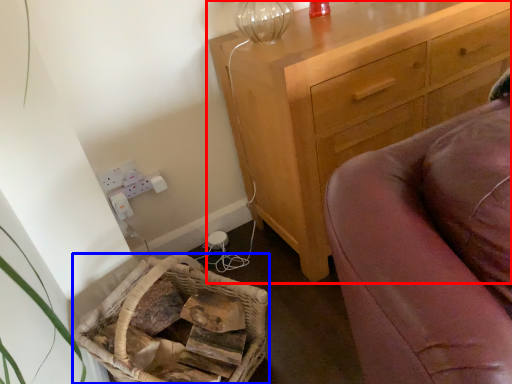
Question: Among these objects, which one is nearest to the camera, chest of drawers (highlighted by a red box) or basket (highlighted by a blue box)?

Choices:
 (A) chest of drawers
 (B) basket

Answer: (B)